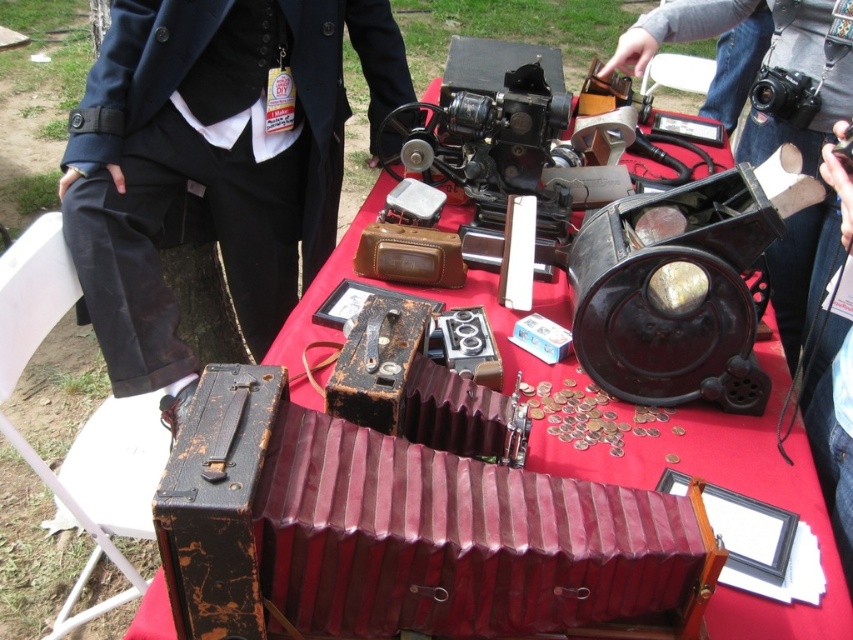
Question: Does leather-like maroon accordion at center come in front of matte black camera at center?

Choices:
 (A) yes
 (B) no

Answer: (A)

Question: Which point appears farthest from the camera in this image?

Choices:
 (A) (314, 616)
 (B) (154, 1)

Answer: (B)

Question: Among these points, which one is farthest from the camera?

Choices:
 (A) (206, 92)
 (B) (521, 531)

Answer: (A)

Question: Which of the following is the farthest from the observer?

Choices:
 (A) (809, 298)
 (B) (157, 48)
 (C) (412, 472)

Answer: (A)

Question: From the image, what is the correct spatial relationship of black fabric coat at upper left in relation to matte black camera at center?

Choices:
 (A) left
 (B) right

Answer: (A)

Question: Can you confirm if leather-like maroon accordion at center is positioned to the left of matte black camera at center?

Choices:
 (A) yes
 (B) no

Answer: (A)